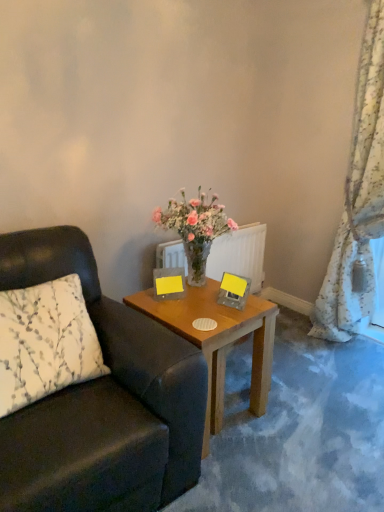
Describe the element at coordinates (218, 341) in the screenshot. I see `wooden table at center` at that location.

This screenshot has height=512, width=384. Describe the element at coordinates (45, 342) in the screenshot. I see `white printed fabric pillow at left` at that location.

Consider the image. Measure the distance between point [2,393] and camera.

Point [2,393] is 4.70 feet away from camera.

Image resolution: width=384 pixels, height=512 pixels. I want to click on clear glass radiator at center, so click(239, 254).

The height and width of the screenshot is (512, 384). What do you see at coordinates (358, 198) in the screenshot?
I see `floral fabric curtain at right` at bounding box center [358, 198].

Where is `leather cushion at left`? This screenshot has width=384, height=512. leather cushion at left is located at coordinates 102,401.

What do you see at coordinates (102, 401) in the screenshot? I see `leather cushion at left` at bounding box center [102, 401].

Locate an element on the screen. This screenshot has width=384, height=512. wooden table at center is located at coordinates (218, 341).

Between point (364, 40) and point (168, 278), which one is positioned behind?

The point (364, 40) is behind.

Is floral fabric curtain at right next to matte yellow picture frame at upper center, the first picture frame from the left, and touching it?

No.

Which object is wider, floral fabric curtain at right or matte yellow picture frame at upper center, the first picture frame from the left?

floral fabric curtain at right.

Does floral fabric curtain at right turn towards matte yellow picture frame at upper center, the 2th picture frame viewed from the right?

Yes, floral fabric curtain at right is facing matte yellow picture frame at upper center, the 2th picture frame viewed from the right.

In the image, is white printed fabric pillow at left on the left side or the right side of yellow paper at center, placed as the second picture frame when sorted from left to right?

Based on their positions, white printed fabric pillow at left is located to the left of yellow paper at center, placed as the second picture frame when sorted from left to right.

Can you confirm if white printed fabric pillow at left is smaller than yellow paper at center, the 1th picture frame when ordered from right to left?

Incorrect, white printed fabric pillow at left is not smaller in size than yellow paper at center, the 1th picture frame when ordered from right to left.

I want to click on pillow located in front of the yellow paper at center, the 1th picture frame when ordered from right to left, so click(x=45, y=342).

Which is behind, point (14, 384) or point (235, 284)?

The point (235, 284) is more distant.

In the scene shown: In the image, is yellow paper at center, placed as the second picture frame when sorted from left to right, positioned in front of or behind white printed fabric pillow at left?

In the image, yellow paper at center, placed as the second picture frame when sorted from left to right, appears behind white printed fabric pillow at left.

Is point (237, 276) behind point (0, 308)?

Yes, it is.

Is yellow paper at center, placed as the second picture frame when sorted from left to right, wider than white printed fabric pillow at left?

No.

How different are the orientations of yellow paper at center, the 1th picture frame when ordered from right to left, and white printed fabric pillow at left in degrees?

There is a 80.7-degree angle between the facing directions of yellow paper at center, the 1th picture frame when ordered from right to left, and white printed fabric pillow at left.

Between leather cushion at left and wooden table at center, which one has smaller size?

wooden table at center is smaller.

Considering the relative sizes of leather cushion at left and wooden table at center in the image provided, is leather cushion at left wider than wooden table at center?

Yes.

Consider the image. From a real-world perspective, is leather cushion at left above or below wooden table at center?

From a real-world perspective, leather cushion at left is physically above wooden table at center.

Would you say leather cushion at left is to the left or to the right of wooden table at center in the picture?

In the image, leather cushion at left appears on the left side of wooden table at center.

In the scene shown: Considering the relative positions of clear glass radiator at center and yellow paper at center, the 1th picture frame when ordered from right to left, in the image provided, is clear glass radiator at center to the left or to the right of yellow paper at center, the 1th picture frame when ordered from right to left,?

In the image, clear glass radiator at center appears on the left side of yellow paper at center, the 1th picture frame when ordered from right to left.

Which object is wider, clear glass radiator at center or yellow paper at center, placed as the second picture frame when sorted from left to right?

yellow paper at center, placed as the second picture frame when sorted from left to right, is wider.

Can we say clear glass radiator at center lies outside yellow paper at center, placed as the second picture frame when sorted from left to right?

Indeed, clear glass radiator at center is completely outside yellow paper at center, placed as the second picture frame when sorted from left to right.

Is clear glass radiator at center bigger or smaller than yellow paper at center, the 1th picture frame when ordered from right to left?

In the image, clear glass radiator at center appears to be larger than yellow paper at center, the 1th picture frame when ordered from right to left.

Locate an element on the screen. This screenshot has height=512, width=384. picture frame behind the yellow paper at center, placed as the second picture frame when sorted from left to right is located at coordinates (168, 283).

Is matte yellow picture frame at upper center, the 2th picture frame viewed from the right, situated inside yellow paper at center, the 1th picture frame when ordered from right to left, or outside?

The correct answer is: outside.

Is the surface of matte yellow picture frame at upper center, the 2th picture frame viewed from the right, in direct contact with yellow paper at center, placed as the second picture frame when sorted from left to right?

No, matte yellow picture frame at upper center, the 2th picture frame viewed from the right, is not touching yellow paper at center, placed as the second picture frame when sorted from left to right.

Is matte yellow picture frame at upper center, the 2th picture frame viewed from the right, oriented away from yellow paper at center, the 1th picture frame when ordered from right to left?

That's not correct — matte yellow picture frame at upper center, the 2th picture frame viewed from the right, is not looking away from yellow paper at center, the 1th picture frame when ordered from right to left.

Looking at their sizes, would you say clear glass radiator at center is wider or thinner than white printed fabric pillow at left?

Considering their sizes, clear glass radiator at center looks slimmer than white printed fabric pillow at left.

Is clear glass radiator at center far from white printed fabric pillow at left?

Yes.

Is point (223, 238) positioned in front of point (13, 374)?

No, (223, 238) is further to viewer.

From a real-world perspective, is clear glass radiator at center located beneath white printed fabric pillow at left?

Yes.

Image resolution: width=384 pixels, height=512 pixels. What are the coordinates of `the 1st picture frame below the floral fabric curtain at right (from the image's perspective)` in the screenshot? It's located at (168, 283).

The height and width of the screenshot is (512, 384). Find the location of `the 2nd picture frame counting from the right side of the white printed fabric pillow at left`. the 2nd picture frame counting from the right side of the white printed fabric pillow at left is located at coordinates (233, 290).

Looking at the image, which one is located further to leather cushion at left, floral fabric curtain at right or wooden table at center?

floral fabric curtain at right lies further to leather cushion at left than the other object.

From the image, which object appears to be nearer to clear glass radiator at center, white printed fabric pillow at left or floral fabric curtain at right?

Among the two, floral fabric curtain at right is located nearer to clear glass radiator at center.

When comparing their distances from matte yellow picture frame at upper center, the first picture frame from the left, does white printed fabric pillow at left or leather cushion at left seem further?

white printed fabric pillow at left lies further to matte yellow picture frame at upper center, the first picture frame from the left, than the other object.

Based on the photo, looking at the image, which one is located further to floral fabric curtain at right, wooden table at center or yellow paper at center, placed as the second picture frame when sorted from left to right?

yellow paper at center, placed as the second picture frame when sorted from left to right, is positioned further to the anchor floral fabric curtain at right.

Based on their spatial positions, is yellow paper at center, the 1th picture frame when ordered from right to left, or white printed fabric pillow at left further from floral fabric curtain at right?

Based on the image, white printed fabric pillow at left appears to be further to floral fabric curtain at right.

Looking at the image, which one is located further to yellow paper at center, the 1th picture frame when ordered from right to left, wooden table at center or floral fabric curtain at right?

Among the two, floral fabric curtain at right is located further to yellow paper at center, the 1th picture frame when ordered from right to left.

When comparing their distances from matte yellow picture frame at upper center, the 2th picture frame viewed from the right, does yellow paper at center, the 1th picture frame when ordered from right to left, or white printed fabric pillow at left seem further?

Among the two, white printed fabric pillow at left is located further to matte yellow picture frame at upper center, the 2th picture frame viewed from the right.

Looking at this image, looking at the image, which one is located further to leather cushion at left, wooden table at center or floral fabric curtain at right?

floral fabric curtain at right is further to leather cushion at left.

Identify the location of coffee table situated between leather cushion at left and floral fabric curtain at right from left to right. (218, 341).

In order to click on radiator between matte yellow picture frame at upper center, the 2th picture frame viewed from the right, and floral fabric curtain at right in this screenshot , I will do `click(239, 254)`.

The height and width of the screenshot is (512, 384). In order to click on pillow between leather cushion at left and wooden table at center in the front-back direction in this screenshot , I will do `click(45, 342)`.

In order to click on radiator between leather cushion at left and floral fabric curtain at right in this screenshot , I will do `click(239, 254)`.